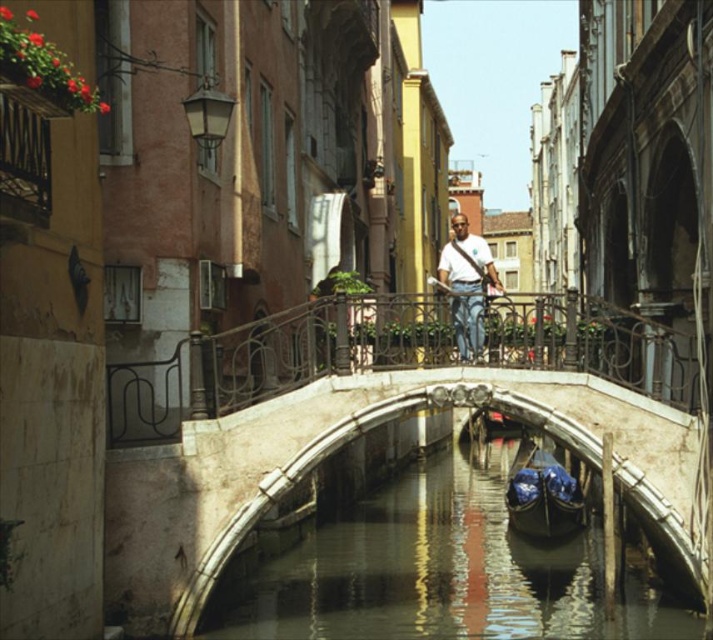
Is point (666, 362) positioned behind point (535, 522)?

That is False.

Between metallic iron bridge at center and black polished wood boat at center, which one is positioned higher?

metallic iron bridge at center is above.

Which is behind, point (170, 406) or point (538, 488)?

Positioned behind is point (538, 488).

Find the location of a particular element. The width and height of the screenshot is (713, 640). metallic iron bridge at center is located at coordinates (272, 360).

Does black polished wood boat at center have a lesser height compared to white fabric shirt at center?

Correct, black polished wood boat at center is not as tall as white fabric shirt at center.

Does point (550, 461) lie behind point (456, 308)?

Yes.

The height and width of the screenshot is (640, 713). What are the coordinates of `black polished wood boat at center` in the screenshot? It's located at (543, 497).

Does white stone bridge at center have a greater width compared to metallic iron bridge at center?

Correct, the width of white stone bridge at center exceeds that of metallic iron bridge at center.

Which is below, white stone bridge at center or metallic iron bridge at center?

white stone bridge at center is lower down.

Where is `white stone bridge at center`? white stone bridge at center is located at coordinates (381, 403).